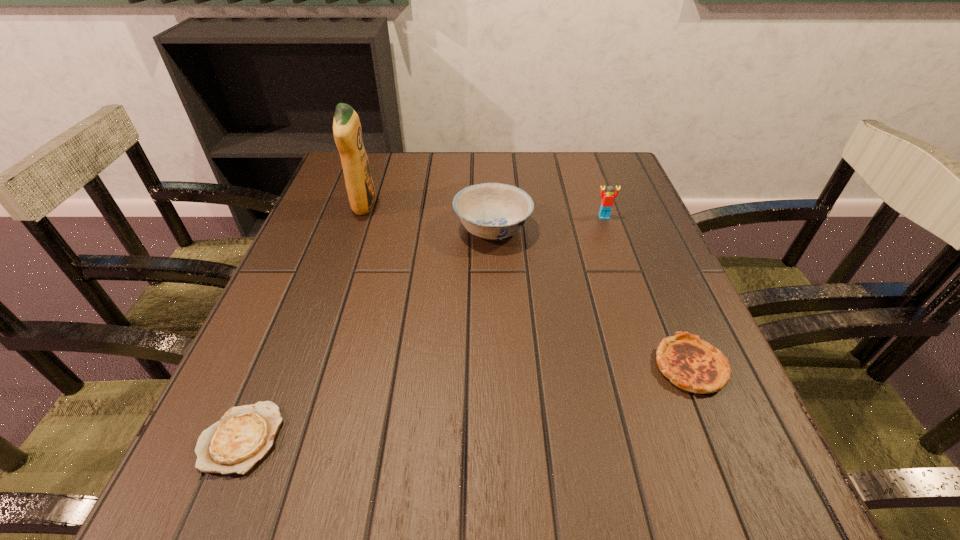
I want to click on free space between the Lego and the nearer quiche, so click(422, 327).

Locate an element on the screen. free point between the detergent and the nearer quiche is located at coordinates (302, 322).

This screenshot has height=540, width=960. Identify the location of free space between the tallest object and the nearest object. (x=302, y=322).

In order to click on empty location between the bowl and the shorter quiche in this screenshot , I will do `click(367, 333)`.

This screenshot has width=960, height=540. In order to click on vacant area between the fourth farthest object and the tallest object in this screenshot , I will do `click(527, 286)`.

The height and width of the screenshot is (540, 960). What are the coordinates of `free space between the nearer quiche and the right quiche` in the screenshot? It's located at (466, 402).

Where is `free space between the shortest object and the detergent`? The image size is (960, 540). free space between the shortest object and the detergent is located at coordinates (302, 322).

At what (x,y) coordinates should I click in order to perform the action: click on the fourth closest object to the Lego. Please return your answer as a coordinate pair (x, y). This screenshot has height=540, width=960. Looking at the image, I should click on (245, 434).

Identify which object is the third nearest to the tallest object. Please provide its 2D coordinates. Your answer should be formatted as a tuple, i.e. [(x, y)], where the tuple contains the x and y coordinates of a point satisfying the conditions above.

[(607, 198)]

Find the location of a particular element. vacant space that satisfies the following two spatial constraints: 1. on the face of the fourth farthest object; 2. on the right side of the Lego is located at coordinates (657, 367).